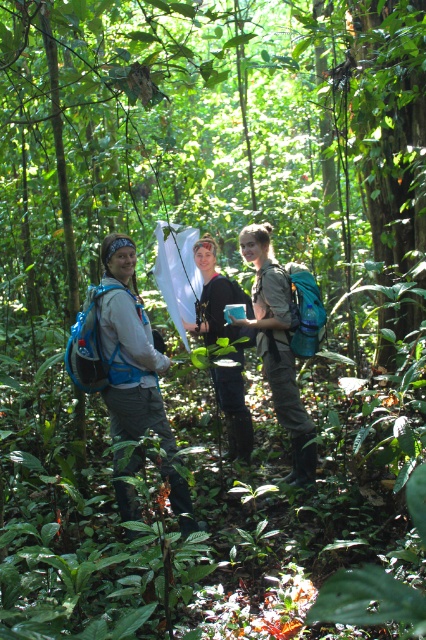
You are part of a hiking group in the jungle. You notice the matte blue backpack at center and the black matte shirt at center. Which item is taller when viewed from above?

The matte blue backpack at center is taller than the black matte shirt at center.

Based on the photo, you are part of a jungle exploration team and need to locate your two blue backpacks. You remember that the blue fabric backpack at left was placed to the left of the matte blue backpack at center. Which backpack is closer to the left edge of the image?

The blue fabric backpack at left is positioned on the left side of the matte blue backpack at center, so the blue fabric backpack at left is closer to the left edge of the image.